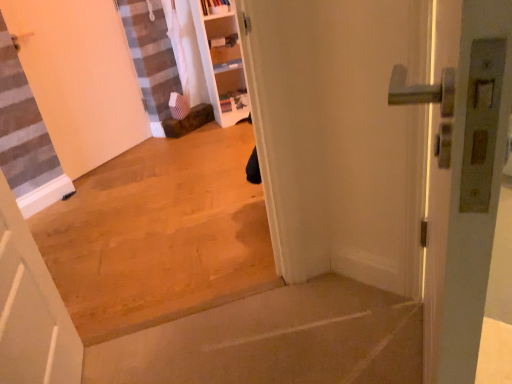
Find the location of a particular element. white matte door at lower left, which ranks as the third door in back-to-front order is located at coordinates (31, 309).

At what (x,y) coordinates should I click in order to perform the action: click on brown wood floor at center, which is the first concrete from top to bottom. Please return your answer as a coordinate pair (x, y). The image size is (512, 384). Looking at the image, I should click on (159, 234).

The image size is (512, 384). I want to click on white matte door at lower left, the 1th door in the front-to-back sequence, so click(31, 309).

Between point (129, 251) and point (59, 379), which one is positioned behind?

The point (129, 251) is farther.

Can you confirm if brown wood floor at center, which is the first concrete from top to bottom, is wider than white matte door at lower left, which ranks as the third door in back-to-front order?

Incorrect, the width of brown wood floor at center, which is the first concrete from top to bottom, does not surpass that of white matte door at lower left, which ranks as the third door in back-to-front order.

Is brown wood floor at center, which is the first concrete from top to bottom, taller or shorter than white matte door at lower left, the second door from the right?

Considering their sizes, brown wood floor at center, which is the first concrete from top to bottom, has more height than white matte door at lower left, the second door from the right.

Looking at the image, does brown wood floor at center, which is the first concrete from top to bottom, seem bigger or smaller compared to white matte door at lower left, which ranks as the third door in back-to-front order?

In the image, brown wood floor at center, which is the first concrete from top to bottom, appears to be larger than white matte door at lower left, which ranks as the third door in back-to-front order.

In terms of width, does metallic silver handle at right, which is counted as the 2th door, starting from the back, look wider or thinner when compared to white matte door at left, marked as the 3th door in a front-to-back arrangement?

metallic silver handle at right, which is counted as the 2th door, starting from the back, is wider than white matte door at left, marked as the 3th door in a front-to-back arrangement.

Are metallic silver handle at right, which is counted as the 2th door, starting from the back, and white matte door at left, which is the 1th door from back to front, located far from each other?

Yes, metallic silver handle at right, which is counted as the 2th door, starting from the back, is far from white matte door at left, which is the 1th door from back to front.

Consider the image. Choose the correct answer: Is metallic silver handle at right, the first door viewed from the right, inside white matte door at left, which ranks as the third door in right-to-left order, or outside it?

metallic silver handle at right, the first door viewed from the right, exists outside the volume of white matte door at left, which ranks as the third door in right-to-left order.

Does point (440, 171) come behind point (134, 100)?

That is False.

Could you measure the distance between white matte door at lower left, which ranks as the third door in back-to-front order, and brown wood floor at center, which is the first concrete from top to bottom?

They are 28.75 inches apart.

Is white matte door at lower left, the 1th door in the front-to-back sequence, not inside brown wood floor at center, which is the first concrete from top to bottom?

Absolutely, white matte door at lower left, the 1th door in the front-to-back sequence, is external to brown wood floor at center, which is the first concrete from top to bottom.

Consider the image. In the image, is white matte door at lower left, the 1th door in the front-to-back sequence, positioned in front of or behind brown wood floor at center, which is the first concrete from top to bottom?

In the image, white matte door at lower left, the 1th door in the front-to-back sequence, appears in front of brown wood floor at center, which is the first concrete from top to bottom.

Is white matte door at lower left, the 1th door in the front-to-back sequence, positioned far away from brown wood floor at center, acting as the second concrete starting from the bottom?

white matte door at lower left, the 1th door in the front-to-back sequence, is near brown wood floor at center, acting as the second concrete starting from the bottom, not far away.

From the image's perspective, is metallic silver handle at right, which is the third door from left to right, below smooth concrete step at lower center, acting as the 2th concrete starting from the top?

No, from the image's perspective, metallic silver handle at right, which is the third door from left to right, is not beneath smooth concrete step at lower center, acting as the 2th concrete starting from the top.

Is metallic silver handle at right, which is the third door from left to right, turned away from smooth concrete step at lower center, placed as the first concrete when sorted from bottom to top?

No, metallic silver handle at right, which is the third door from left to right, is not facing away from smooth concrete step at lower center, placed as the first concrete when sorted from bottom to top.

From a real-world perspective, who is located lower, metallic silver handle at right, the first door viewed from the right, or smooth concrete step at lower center, acting as the 2th concrete starting from the top?

In real-world perspective, smooth concrete step at lower center, acting as the 2th concrete starting from the top, is lower.

Considering the relative sizes of metallic silver handle at right, the first door viewed from the right, and smooth concrete step at lower center, acting as the 2th concrete starting from the top, in the image provided, is metallic silver handle at right, the first door viewed from the right, bigger than smooth concrete step at lower center, acting as the 2th concrete starting from the top,?

Incorrect, metallic silver handle at right, the first door viewed from the right, is not larger than smooth concrete step at lower center, acting as the 2th concrete starting from the top.

In the scene shown: Is brown wood floor at center, acting as the second concrete starting from the bottom, aimed at metallic silver handle at right, the first door viewed from the right?

No, brown wood floor at center, acting as the second concrete starting from the bottom, is not turned towards metallic silver handle at right, the first door viewed from the right.

In the scene shown: Between brown wood floor at center, which is the first concrete from top to bottom, and metallic silver handle at right, which is counted as the 2th door, starting from the back, which one has smaller width?

metallic silver handle at right, which is counted as the 2th door, starting from the back, is thinner.

From the image's perspective, is brown wood floor at center, which is the first concrete from top to bottom, on metallic silver handle at right, the first door viewed from the right?

Yes.

Does brown wood floor at center, acting as the second concrete starting from the bottom, lie in front of metallic silver handle at right, the first door viewed from the right?

No, it is not.

Consider the image. Which is further, (52, 325) or (298, 371)?

The point (298, 371) is farther from the camera.

Does white matte door at lower left, which ranks as the third door in back-to-front order, lie behind smooth concrete step at lower center, placed as the first concrete when sorted from bottom to top?

No, it is in front of smooth concrete step at lower center, placed as the first concrete when sorted from bottom to top.

Can you confirm if white matte door at lower left, which ranks as the third door in back-to-front order, is smaller than smooth concrete step at lower center, placed as the first concrete when sorted from bottom to top?

Yes.

From the image's perspective, which one is positioned higher, white matte door at lower left, the 1th door in the front-to-back sequence, or smooth concrete step at lower center, placed as the first concrete when sorted from bottom to top?

From the image's view, white matte door at lower left, the 1th door in the front-to-back sequence, is above.

Based on the photo, is smooth concrete step at lower center, acting as the 2th concrete starting from the top, not near brown wood floor at center, which is the first concrete from top to bottom?

No, smooth concrete step at lower center, acting as the 2th concrete starting from the top, is not far from brown wood floor at center, which is the first concrete from top to bottom.

Looking at this image, which of these two, smooth concrete step at lower center, placed as the first concrete when sorted from bottom to top, or brown wood floor at center, acting as the second concrete starting from the bottom, is bigger?

brown wood floor at center, acting as the second concrete starting from the bottom.

Is point (250, 356) positioned behind point (265, 219)?

No.

From a real-world perspective, who is located lower, smooth concrete step at lower center, acting as the 2th concrete starting from the top, or brown wood floor at center, acting as the second concrete starting from the bottom?

From a 3D spatial view, smooth concrete step at lower center, acting as the 2th concrete starting from the top, is below.

What are the coordinates of `concrete above the white matte door at lower left, the second door from the right (from the image's perspective)` in the screenshot? It's located at (159, 234).

Starting from the white matte door at left, which ranks as the third door in right-to-left order, which door is the 2nd one to the right? Please provide its 2D coordinates.

[(462, 175)]

Estimate the real-world distances between objects in this image. Which object is closer to brown wood floor at center, which is the first concrete from top to bottom, smooth concrete step at lower center, acting as the 2th concrete starting from the top, or white matte door at left, which is the 1th door from back to front?

smooth concrete step at lower center, acting as the 2th concrete starting from the top, is closer to brown wood floor at center, which is the first concrete from top to bottom.

Looking at the image, which one is located closer to brown wood floor at center, which is the first concrete from top to bottom, metallic silver handle at right, the first door viewed from the right, or white matte door at left, positioned as the 1th door in left-to-right order?

white matte door at left, positioned as the 1th door in left-to-right order, lies closer to brown wood floor at center, which is the first concrete from top to bottom, than the other object.

Which object lies nearer to the anchor point white matte door at left, positioned as the 1th door in left-to-right order, smooth concrete step at lower center, acting as the 2th concrete starting from the top, or brown wood floor at center, which is the first concrete from top to bottom?

brown wood floor at center, which is the first concrete from top to bottom, lies closer to white matte door at left, positioned as the 1th door in left-to-right order, than the other object.

When comparing their distances from brown wood floor at center, which is the first concrete from top to bottom, does smooth concrete step at lower center, placed as the first concrete when sorted from bottom to top, or white matte door at lower left, which ranks as the third door in back-to-front order, seem closer?

smooth concrete step at lower center, placed as the first concrete when sorted from bottom to top.

When comparing their distances from smooth concrete step at lower center, placed as the first concrete when sorted from bottom to top, does white matte door at left, marked as the 3th door in a front-to-back arrangement, or white matte door at lower left, the second door from the right, seem closer?

The object closer to smooth concrete step at lower center, placed as the first concrete when sorted from bottom to top, is white matte door at lower left, the second door from the right.

Looking at the image, which one is located further to smooth concrete step at lower center, placed as the first concrete when sorted from bottom to top, metallic silver handle at right, which is counted as the 2th door, starting from the back, or white matte door at lower left, which ranks as the third door in back-to-front order?

Among the two, metallic silver handle at right, which is counted as the 2th door, starting from the back, is located further to smooth concrete step at lower center, placed as the first concrete when sorted from bottom to top.

Which object lies further to the anchor point brown wood floor at center, acting as the second concrete starting from the bottom, metallic silver handle at right, the first door viewed from the right, or white matte door at lower left, which appears as the second door when viewed from the left?

Among the two, metallic silver handle at right, the first door viewed from the right, is located further to brown wood floor at center, acting as the second concrete starting from the bottom.

Based on their spatial positions, is white matte door at lower left, which appears as the second door when viewed from the left, or smooth concrete step at lower center, acting as the 2th concrete starting from the top, further from white matte door at left, which ranks as the third door in right-to-left order?

Based on the image, smooth concrete step at lower center, acting as the 2th concrete starting from the top, appears to be further to white matte door at left, which ranks as the third door in right-to-left order.

Locate an element on the screen. This screenshot has height=384, width=512. concrete between white matte door at lower left, the 1th door in the front-to-back sequence, and smooth concrete step at lower center, acting as the 2th concrete starting from the top, in the horizontal direction is located at coordinates (159, 234).

This screenshot has width=512, height=384. In order to click on concrete between smooth concrete step at lower center, placed as the first concrete when sorted from bottom to top, and white matte door at left, which is the 1th door from back to front, along the z-axis in this screenshot , I will do `click(159, 234)`.

Identify the location of concrete situated between brown wood floor at center, which is the first concrete from top to bottom, and metallic silver handle at right, the first door viewed from the right, from left to right. This screenshot has width=512, height=384. (275, 341).

Locate an element on the screen. This screenshot has height=384, width=512. door between white matte door at left, marked as the 3th door in a front-to-back arrangement, and metallic silver handle at right, which is the 2th door from front to back, in the horizontal direction is located at coordinates pos(31,309).